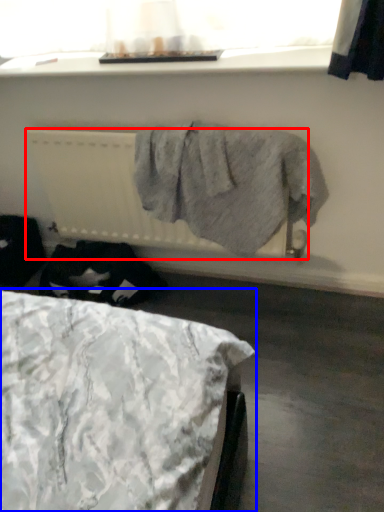
Question: Among these objects, which one is nearest to the camera, radiator (highlighted by a red box) or bed (highlighted by a blue box)?

Choices:
 (A) radiator
 (B) bed

Answer: (B)